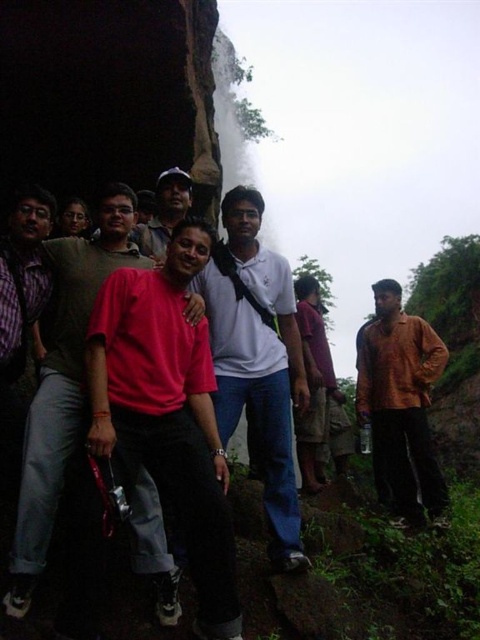
Looking at this image, you are a photographer trying to capture the best angle of the group. You notice two points in the scene labeled as point (76, 291) and point (168, 230). Which point is positioned closer to you, the photographer?

Point (76, 291) is closer to the viewer than point (168, 230).